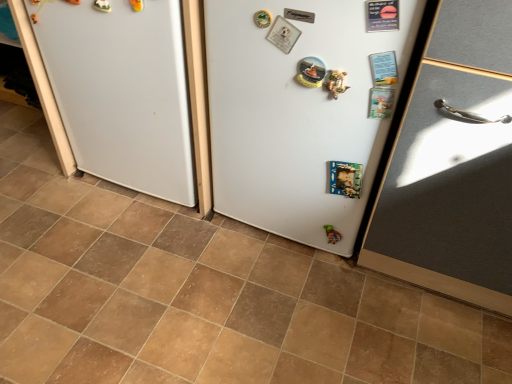
Describe the element at coordinates (122, 92) in the screenshot. This screenshot has height=384, width=512. I see `white matte refrigerator at center, arranged as the second fridge when viewed from the right` at that location.

Where is `matte gray door at right`? matte gray door at right is located at coordinates (453, 165).

You are a GUI agent. You are given a task and a screenshot of the screen. Output one action in this format:
    pyautogui.click(x=<x>, y=<y>)
    Task: Click on the brown tile at center
    The height and width of the screenshot is (384, 512).
    Given the screenshot: What is the action you would take?
    pyautogui.click(x=201, y=294)

Between matte gray door at right and green matte toy at lower center, which one has less height?

Standing shorter between the two is green matte toy at lower center.

From the picture: From a real-world perspective, is matte gray door at right on green matte toy at lower center?

Yes.

Locate an element on the screen. Image resolution: width=512 pixels, height=384 pixels. toy behind the matte gray door at right is located at coordinates (332, 234).

Visually, is matte gray door at right positioned to the left or to the right of green matte toy at lower center?

matte gray door at right is to the right of green matte toy at lower center.

Is point (86, 364) closer to viewer compared to point (102, 161)?

Yes.

Choose the correct answer: Is brown tile at center inside white matte refrigerator at center, arranged as the second fridge when viewed from the right, or outside it?

brown tile at center is outside white matte refrigerator at center, arranged as the second fridge when viewed from the right.

Is brown tile at center oriented away from white matte refrigerator at center, arranged as the second fridge when viewed from the right?

No, brown tile at center is not facing away from white matte refrigerator at center, arranged as the second fridge when viewed from the right.

Which of these two, brown tile at center or white matte refrigerator at center, arranged as the second fridge when viewed from the right, is bigger?

white matte refrigerator at center, arranged as the second fridge when viewed from the right, is bigger.

Which of these two, white matte refrigerator at center, which appears as the first fridge when viewed from the left, or green matte toy at lower center, is wider?

Wider between the two is white matte refrigerator at center, which appears as the first fridge when viewed from the left.

Between white matte refrigerator at center, arranged as the second fridge when viewed from the right, and green matte toy at lower center, which one has larger size?

white matte refrigerator at center, arranged as the second fridge when viewed from the right.

This screenshot has width=512, height=384. There is a green matte toy at lower center. Identify the location of the 1st fridge above it (from a real-world perspective). click(122, 92).

In the image, is matte gray door at right on the left side or the right side of white matte refrigerator at center, which appears as the first fridge when viewed from the left?

matte gray door at right is to the right of white matte refrigerator at center, which appears as the first fridge when viewed from the left.

From a real-world perspective, which is physically above, matte gray door at right or white matte refrigerator at center, which appears as the first fridge when viewed from the left?

matte gray door at right is physically above.

Considering the positions of point (446, 282) and point (179, 90), is point (446, 282) closer or farther from the camera than point (179, 90)?

Point (446, 282) appears to be farther away from the viewer than point (179, 90).

Does white matte refrigerator at center, arranged as the second fridge when viewed from the right, lie in front of matte gray door at right?

No, the depth of white matte refrigerator at center, arranged as the second fridge when viewed from the right, is greater than that of matte gray door at right.

Consider the image. Considering the sizes of objects white matte refrigerator at center, arranged as the second fridge when viewed from the right, and matte gray door at right in the image provided, who is wider, white matte refrigerator at center, arranged as the second fridge when viewed from the right, or matte gray door at right?

Wider between the two is matte gray door at right.

Is white matte refrigerator at center, arranged as the second fridge when viewed from the right, in contact with matte gray door at right?

No, white matte refrigerator at center, arranged as the second fridge when viewed from the right, is not making contact with matte gray door at right.

Is white matte refrigerator at center, which appears as the first fridge when viewed from the left, aimed at matte gray door at right?

No.

Could you tell me if brown tile at center is turned towards matte gray door at right?

No, brown tile at center is not facing towards matte gray door at right.

You are a GUI agent. You are given a task and a screenshot of the screen. Output one action in this format:
    pyautogui.click(x=<x>, y=<y>)
    Task: Click on the tile below the matte gray door at right (from a real-world perspective)
    Image resolution: width=512 pixels, height=384 pixels.
    Given the screenshot: What is the action you would take?
    pyautogui.click(x=201, y=294)

From a real-world perspective, is brown tile at center positioned above or below matte gray door at right?

brown tile at center is below matte gray door at right.

Is point (29, 157) closer or farther from the camera than point (420, 106)?

Point (29, 157) appears to be farther away from the viewer than point (420, 106).

Between brown tile at center and green matte toy at lower center, which one has larger width?

With larger width is brown tile at center.

Could you tell me if brown tile at center is facing green matte toy at lower center?

No, brown tile at center is not turned towards green matte toy at lower center.

Who is taller, brown tile at center or green matte toy at lower center?

green matte toy at lower center.

Visually, is brown tile at center positioned to the left or to the right of green matte toy at lower center?

brown tile at center is to the left of green matte toy at lower center.

Identify the location of toy that is behind the matte gray door at right. This screenshot has width=512, height=384. (332, 234).

There is a brown tile at center. Where is `the 2nd fridge above it (from the image's perspective)`? Image resolution: width=512 pixels, height=384 pixels. the 2nd fridge above it (from the image's perspective) is located at coordinates (122, 92).

When comparing their distances from matte gray door at right, does green matte toy at lower center or white matte refrigerator at center, acting as the 2th fridge starting from the left, seem further?

green matte toy at lower center lies further to matte gray door at right than the other object.

Considering their positions, is green matte toy at lower center positioned further to white matte refrigerator at center, the 1th fridge when ordered from right to left, than white matte refrigerator at center, which appears as the first fridge when viewed from the left?

green matte toy at lower center is further to white matte refrigerator at center, the 1th fridge when ordered from right to left.

Looking at the image, which one is located closer to white matte refrigerator at center, which appears as the first fridge when viewed from the left, green matte toy at lower center or white matte refrigerator at center, acting as the 2th fridge starting from the left?

white matte refrigerator at center, acting as the 2th fridge starting from the left, is positioned closer to the anchor white matte refrigerator at center, which appears as the first fridge when viewed from the left.

From the image, which object appears to be farther from green matte toy at lower center, white matte refrigerator at center, acting as the 2th fridge starting from the left, or matte gray door at right?

The object further to green matte toy at lower center is matte gray door at right.

Based on their spatial positions, is white matte refrigerator at center, acting as the 2th fridge starting from the left, or white matte refrigerator at center, arranged as the second fridge when viewed from the right, further from matte gray door at right?

Based on the image, white matte refrigerator at center, arranged as the second fridge when viewed from the right, appears to be further to matte gray door at right.

Which object lies further to the anchor point white matte refrigerator at center, acting as the 2th fridge starting from the left, brown tile at center or white matte refrigerator at center, which appears as the first fridge when viewed from the left?

Based on the image, brown tile at center appears to be further to white matte refrigerator at center, acting as the 2th fridge starting from the left.

When comparing their distances from white matte refrigerator at center, arranged as the second fridge when viewed from the right, does matte gray door at right or brown tile at center seem further?

The object further to white matte refrigerator at center, arranged as the second fridge when viewed from the right, is matte gray door at right.

Looking at the image, which one is located further to green matte toy at lower center, brown tile at center or matte gray door at right?

brown tile at center is positioned further to the anchor green matte toy at lower center.

Locate an element on the screen. The width and height of the screenshot is (512, 384). toy between brown tile at center and matte gray door at right is located at coordinates (332, 234).

Where is `fridge between white matte refrigerator at center, arranged as the second fridge when viewed from the right, and green matte toy at lower center`? This screenshot has height=384, width=512. fridge between white matte refrigerator at center, arranged as the second fridge when viewed from the right, and green matte toy at lower center is located at coordinates point(296,114).

The width and height of the screenshot is (512, 384). Identify the location of fridge between brown tile at center and white matte refrigerator at center, acting as the 2th fridge starting from the left, from left to right. (122, 92).

Identify the location of toy between white matte refrigerator at center, arranged as the second fridge when viewed from the right, and matte gray door at right. (332, 234).